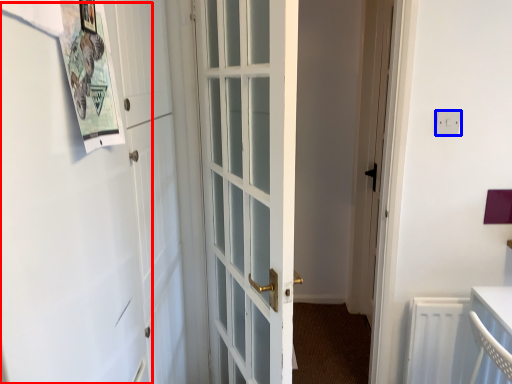
Question: Which object is closer to the camera taking this photo, barn door (highlighted by a red box) or electric outlet (highlighted by a blue box)?

Choices:
 (A) barn door
 (B) electric outlet

Answer: (A)